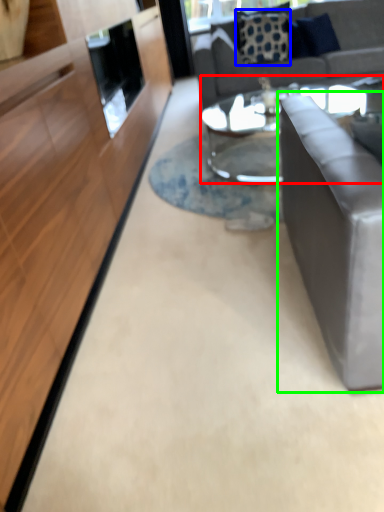
Question: Which is farther away from coffee table (highlighted by a red box)? pillow (highlighted by a blue box) or studio couch (highlighted by a green box)?

Choices:
 (A) pillow
 (B) studio couch

Answer: (B)